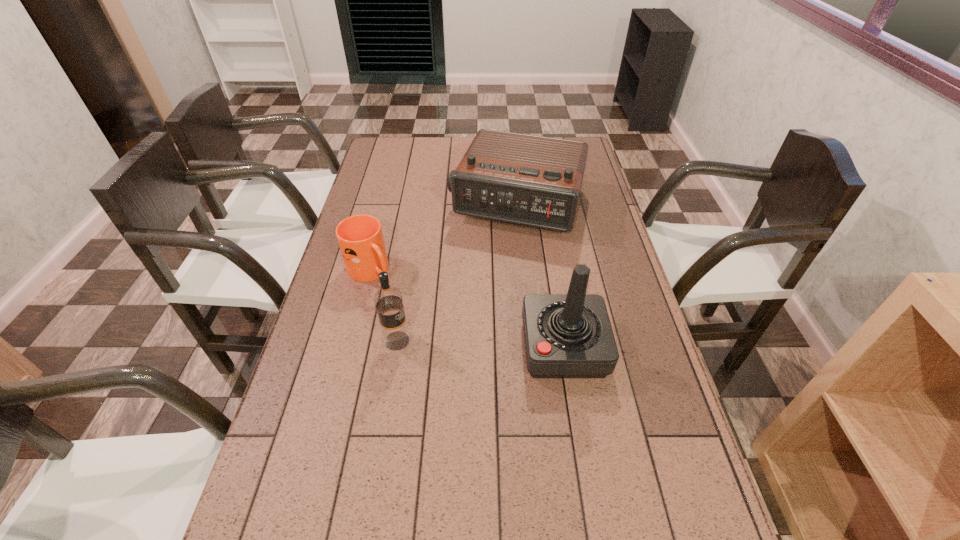
In the image, there is a desktop. Where is `vacant space at the left edge`? vacant space at the left edge is located at coordinates (330, 333).

Locate an element on the screen. The height and width of the screenshot is (540, 960). vacant area at the right edge of the desktop is located at coordinates (613, 446).

Where is `vacant region at the far left corner`? vacant region at the far left corner is located at coordinates (395, 145).

At what (x,y) coordinates should I click in order to perform the action: click on free location at the near right corner. Please return your answer as a coordinate pair (x, y). This screenshot has height=540, width=960. Looking at the image, I should click on (695, 529).

This screenshot has height=540, width=960. I want to click on vacant area between the joystick and the vodka, so click(480, 344).

You are a GUI agent. You are given a task and a screenshot of the screen. Output one action in this format:
    pyautogui.click(x=<x>, y=<y>)
    Task: Click on the free point between the vodka and the farthest object
    The image size is (960, 540).
    Given the screenshot: What is the action you would take?
    pyautogui.click(x=457, y=273)

Where is `vacant area between the third nearest object and the joystick`? The height and width of the screenshot is (540, 960). vacant area between the third nearest object and the joystick is located at coordinates (468, 309).

Identify the location of empty space that is in between the third nearest object and the joystick. The image size is (960, 540). (468, 309).

Locate an element on the screen. The height and width of the screenshot is (540, 960). vacant space that's between the second farthest object and the radio receiver is located at coordinates (444, 238).

The width and height of the screenshot is (960, 540). What are the coordinates of `vacant space that is in between the third object from right to left and the radio receiver` in the screenshot? It's located at (457, 273).